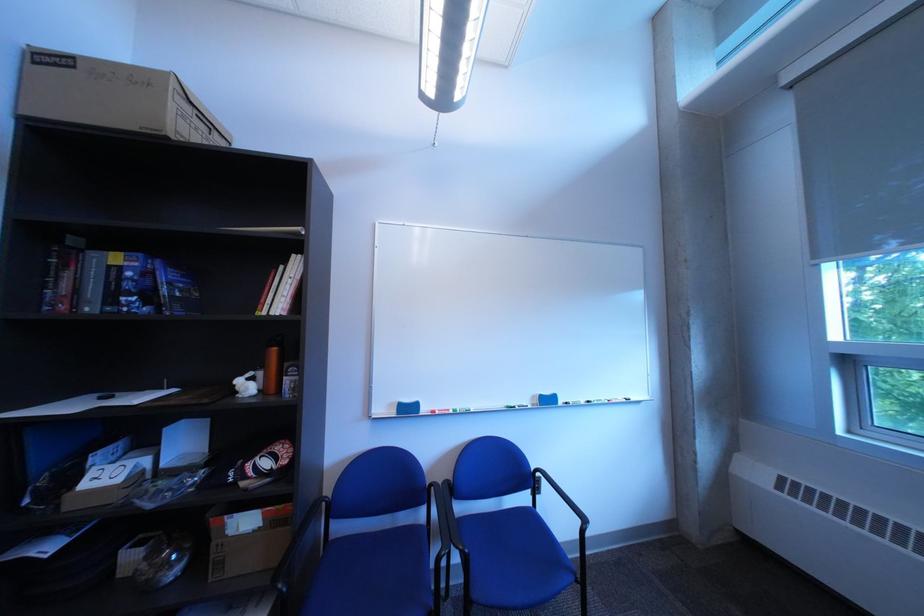
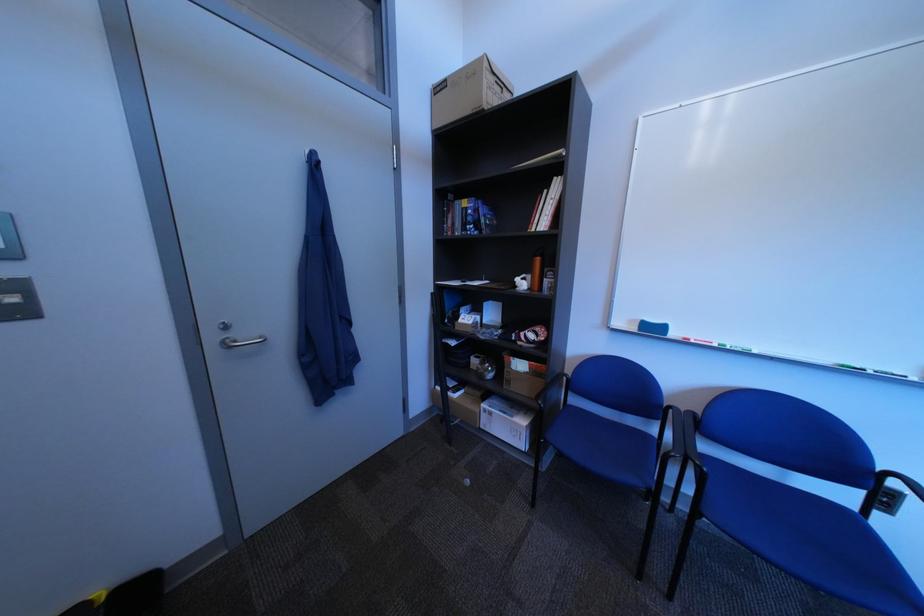
Where in the second image is the point corresponding to (221,402) from the first image?

(517, 290)